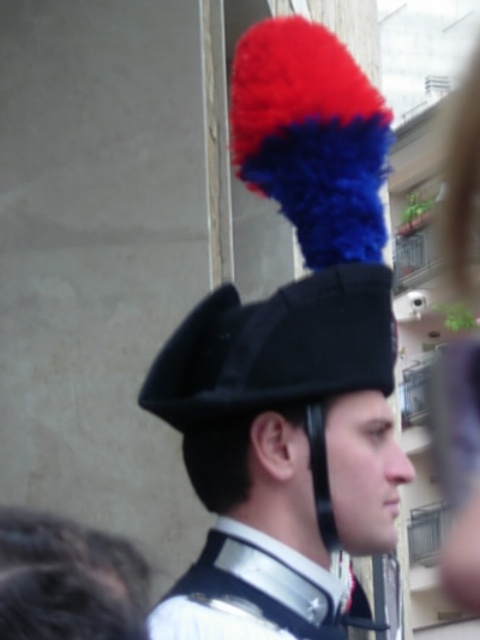
Question: Is black felt hat at center thinner than black felt hat at upper center?

Choices:
 (A) yes
 (B) no

Answer: (B)

Question: Which point is closer to the camera?

Choices:
 (A) black felt hat at upper center
 (B) white glossy uniform at center

Answer: (B)

Question: From the image, what is the correct spatial relationship of black felt hat at center in relation to black felt hat at upper center?

Choices:
 (A) below
 (B) above

Answer: (A)

Question: Does black felt hat at center come behind black felt hat at upper center?

Choices:
 (A) yes
 (B) no

Answer: (B)

Question: Which object is positioned closest to the black felt hat at center?

Choices:
 (A) black felt hat at upper center
 (B) white glossy uniform at center

Answer: (B)

Question: Estimate the real-world distances between objects in this image. Which object is farther from the black felt hat at upper center?

Choices:
 (A) white glossy uniform at center
 (B) black felt hat at center

Answer: (A)